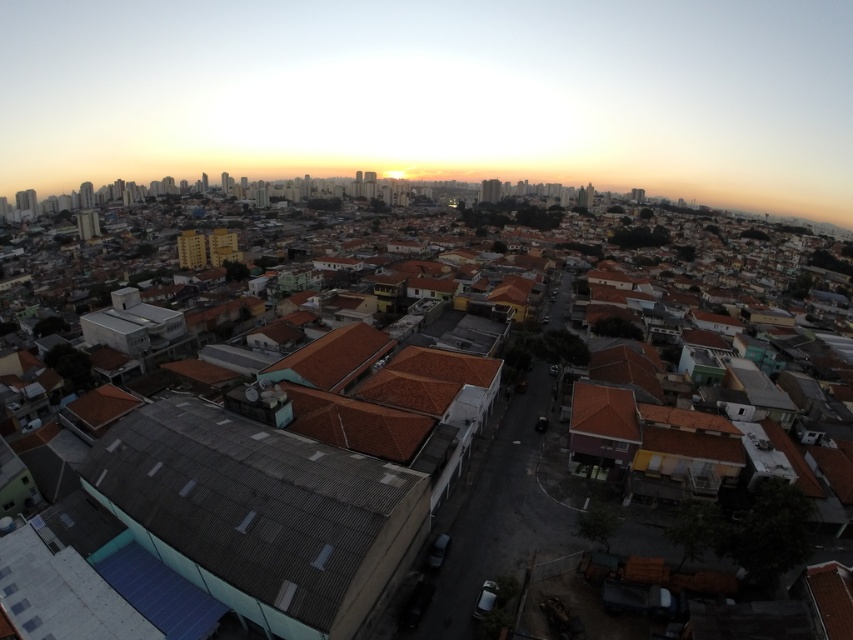
You are a drone operator tasked with photographing two specific roofs in this urban area. The first is the brown tile roof at center, and the second is the gray corrugated metal roof at lower left. Given that your drone has limited battery life, which roof should you photograph first to ensure you can capture both before the battery runs out?

You should photograph the gray corrugated metal roof at lower left first because it is smaller than the brown tile roof at center, requiring less time and battery to capture both.

From the picture: You are a drone operator flying at an altitude of 50 meters. Your mission is to capture a closeup shot of the brown tile roof at center. Can you descend to 40 meters and still maintain a safe distance for the shot?

The brown tile roof at center is located 40.05 meters away from the camera. Descending to 40 meters would place the drone just 0.05 meters above the roof, which is too close and unsafe. Maintain a higher altitude for a safer shot.

You are a drone operator trying to capture a photo of the brown tile roof at center from above. The drone is currently hovering at point [277,484]. Is the drone positioned directly above the brown tile roof at center?

Yes, the drone is positioned directly above the brown tile roof at center because the brown tile roof at center is located at point [277,484] where the drone is hovering.